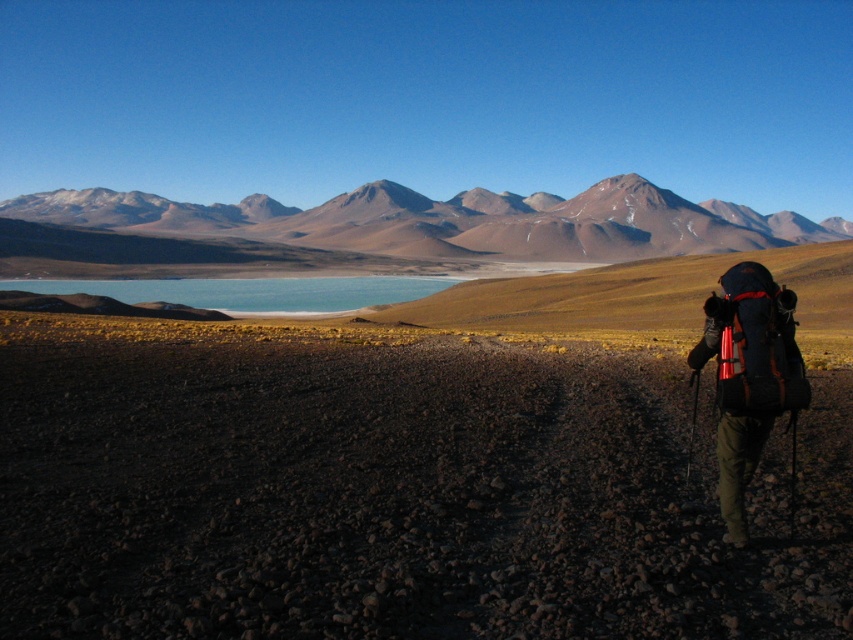
Question: Does smooth brown mountains at upper center have a lesser width compared to matte black backpack at lower right?

Choices:
 (A) yes
 (B) no

Answer: (B)

Question: Which object appears farthest from the camera in this image?

Choices:
 (A) smooth brown mountains at upper center
 (B) matte black backpack at lower right
 (C) black nylon backpack at lower right

Answer: (A)

Question: Does smooth brown mountains at upper center have a lesser width compared to matte black backpack at lower right?

Choices:
 (A) no
 (B) yes

Answer: (A)

Question: Which point is farther to the camera?

Choices:
 (A) black nylon backpack at lower right
 (B) smooth brown mountains at upper center
 (C) matte black backpack at lower right

Answer: (B)

Question: Is smooth brown mountains at upper center closer to camera compared to black nylon backpack at lower right?

Choices:
 (A) no
 (B) yes

Answer: (A)

Question: Which point is farther from the camera taking this photo?

Choices:
 (A) (531, 234)
 (B) (737, 326)
 (C) (776, 388)

Answer: (A)